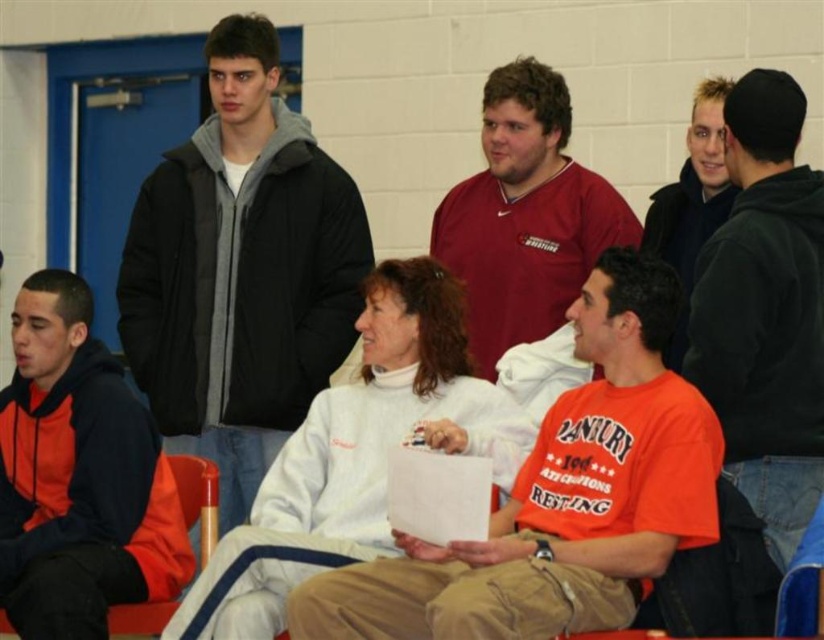
You are standing in the gymnasium and see the point at coordinates [78,476]. Which object is this point located on?

The point at coordinates [78,476] is located on the orange fleece sweatshirt at left.